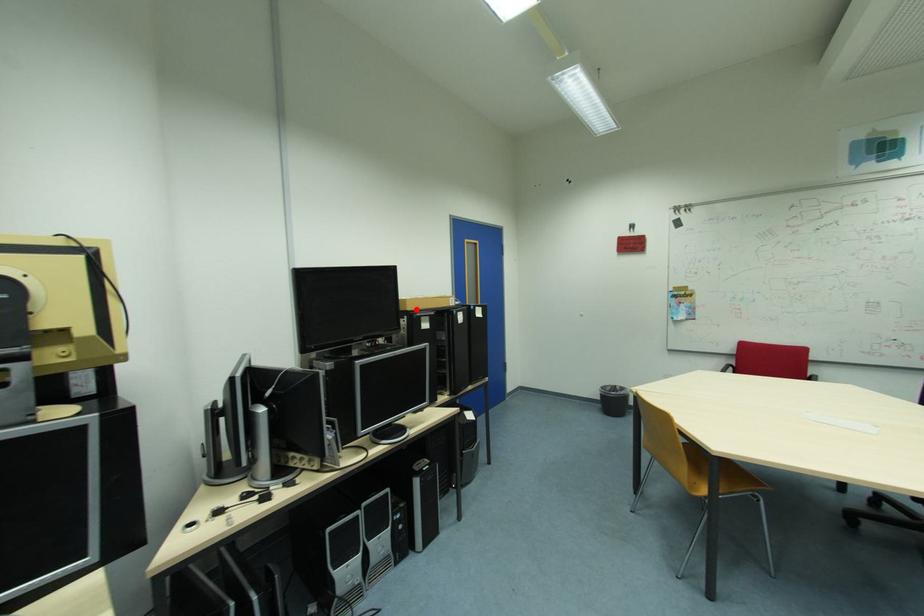
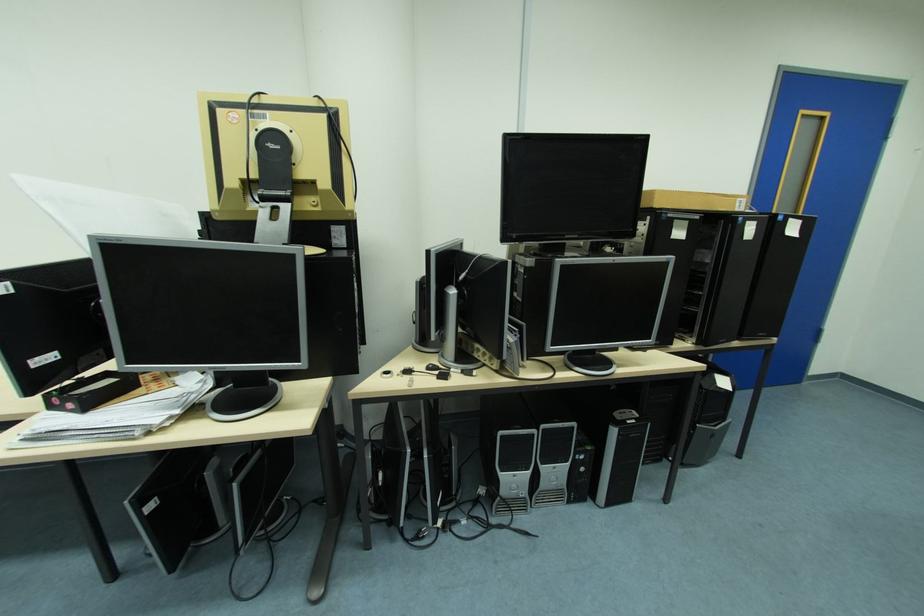
In the second image, find the point that corresponds to the highlighted location in the first image.

(664, 206)